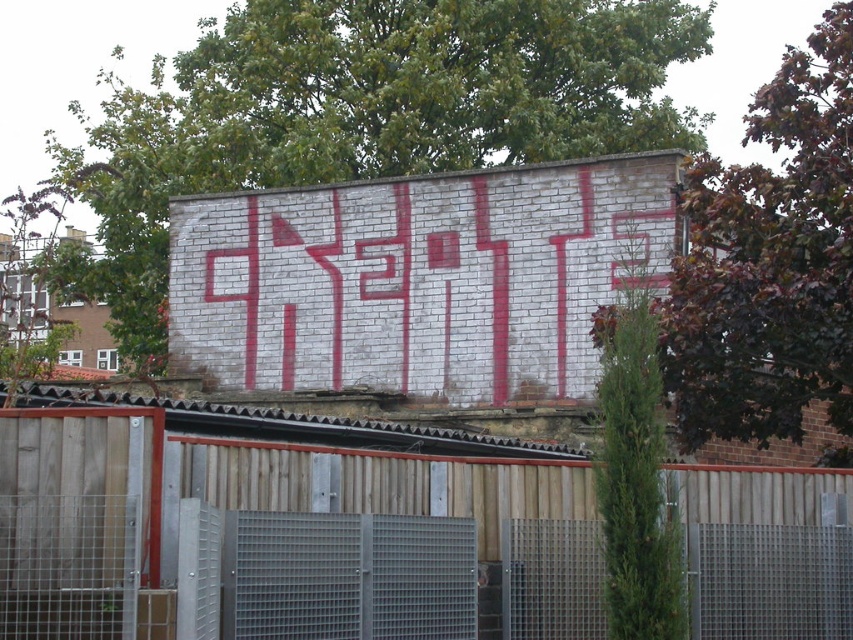
In the scene shown: Between white brick wall at center and wooden fence at center, which one has more height?

With more height is white brick wall at center.

From the picture: Does white brick wall at center appear over wooden fence at center?

Yes.

Who is more distant from viewer, (260, 349) or (843, 522)?

The point (260, 349) is more distant.

Find the location of a particular element. The width and height of the screenshot is (853, 640). white brick wall at center is located at coordinates (416, 278).